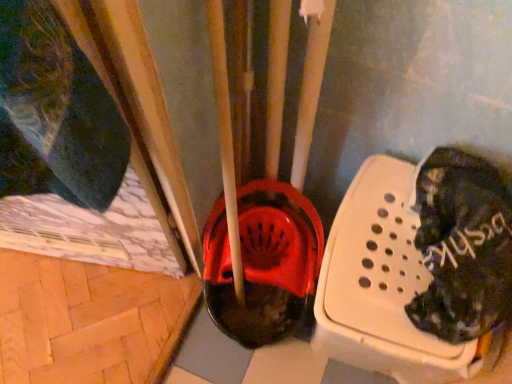
The height and width of the screenshot is (384, 512). What do you see at coordinates (55, 112) in the screenshot?
I see `dark blue fabric at left` at bounding box center [55, 112].

I want to click on dark blue fabric at left, so click(55, 112).

The image size is (512, 384). What do you see at coordinates (462, 246) in the screenshot? I see `black fabric shoe at right` at bounding box center [462, 246].

Where is `black fabric shoe at right`? black fabric shoe at right is located at coordinates coord(462,246).

Locate an element on the screen. dark blue fabric at left is located at coordinates (55, 112).

Between black fabric shoe at right and dark blue fabric at left, which one appears on the right side from the viewer's perspective?

Positioned to the right is black fabric shoe at right.

Does black fabric shoe at right come in front of dark blue fabric at left?

No, it is behind dark blue fabric at left.

Is point (446, 254) farther from viewer compared to point (111, 122)?

Yes, it is behind point (111, 122).

From the image's perspective, does black fabric shoe at right appear lower than dark blue fabric at left?

Correct, black fabric shoe at right appears lower than dark blue fabric at left in the image.

From a real-world perspective, between black fabric shoe at right and dark blue fabric at left, who is vertically higher?

In real-world perspective, black fabric shoe at right is above.

From the picture: Considering the relative sizes of black fabric shoe at right and dark blue fabric at left in the image provided, is black fabric shoe at right wider than dark blue fabric at left?

Correct, the width of black fabric shoe at right exceeds that of dark blue fabric at left.

Between black fabric shoe at right and dark blue fabric at left, which one has less height?

With less height is black fabric shoe at right.

Can you confirm if black fabric shoe at right is smaller than dark blue fabric at left?

Correct, black fabric shoe at right occupies less space than dark blue fabric at left.

Would you say dark blue fabric at left is part of black fabric shoe at right's contents?

No.

Is black fabric shoe at right positioned far away from dark blue fabric at left?

No, black fabric shoe at right is in close proximity to dark blue fabric at left.

Is black fabric shoe at right facing towards dark blue fabric at left?

No.

What are the coordinates of `clothing lying above the black fabric shoe at right (from the image's perspective)` in the screenshot? It's located at coord(55,112).

Would you say dark blue fabric at left is to the left or to the right of black fabric shoe at right in the picture?

dark blue fabric at left is positioned on black fabric shoe at right's left side.

Is dark blue fabric at left behind black fabric shoe at right?

No.

Considering the positions of points (36, 158) and (421, 304), is point (36, 158) farther from camera compared to point (421, 304)?

That is False.

From the image's perspective, is dark blue fabric at left beneath black fabric shoe at right?

Incorrect, from the image's perspective, dark blue fabric at left is higher than black fabric shoe at right.

From a real-world perspective, is dark blue fabric at left positioned above or below black fabric shoe at right?

Clearly, from a real-world perspective, dark blue fabric at left is below black fabric shoe at right.

Considering the sizes of dark blue fabric at left and black fabric shoe at right in the image, is dark blue fabric at left wider or thinner than black fabric shoe at right?

Considering their sizes, dark blue fabric at left looks slimmer than black fabric shoe at right.

Looking at this image, who is taller, dark blue fabric at left or black fabric shoe at right?

dark blue fabric at left.

Can you confirm if dark blue fabric at left is smaller than black fabric shoe at right?

No, dark blue fabric at left is not smaller than black fabric shoe at right.

Is dark blue fabric at left not inside black fabric shoe at right?

Indeed, dark blue fabric at left is completely outside black fabric shoe at right.

Is dark blue fabric at left touching black fabric shoe at right?

No, dark blue fabric at left is not beside black fabric shoe at right.

Is dark blue fabric at left positioned with its back to black fabric shoe at right?

No, dark blue fabric at left is not facing the opposite direction of black fabric shoe at right.

What's the angular difference between dark blue fabric at left and black fabric shoe at right's facing directions?

The angle between the facing direction of dark blue fabric at left and the facing direction of black fabric shoe at right is 15.4 degrees.

Measure the distance between dark blue fabric at left and black fabric shoe at right.

dark blue fabric at left and black fabric shoe at right are 22.64 inches apart from each other.

Find the location of a particular element. clothing to the left of black fabric shoe at right is located at coordinates (55, 112).

Identify the location of clothing that is under the black fabric shoe at right (from a real-world perspective). The width and height of the screenshot is (512, 384). (55, 112).

At what (x,y) coordinates should I click in order to perform the action: click on clothing located on the left of black fabric shoe at right. Please return your answer as a coordinate pair (x, y). The width and height of the screenshot is (512, 384). Looking at the image, I should click on (55, 112).